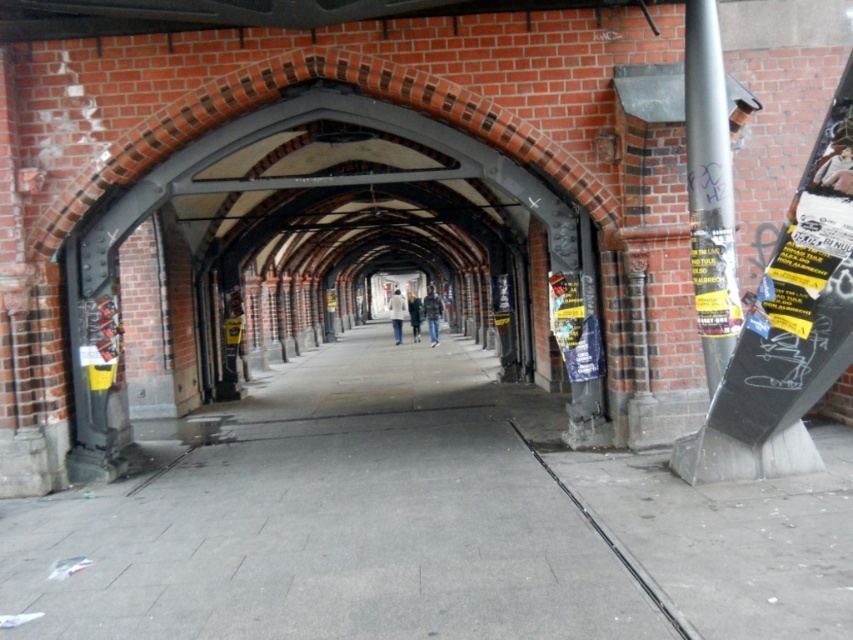
Which is above, gray concrete pavement at center or light beige coat at center?

Positioned higher is light beige coat at center.

From the picture: Who is more forward, (x=456, y=548) or (x=399, y=298)?

Point (x=456, y=548)

I want to click on gray concrete pavement at center, so click(329, 522).

Between dark blue jeans at center and white fabric coat at center, which one is positioned lower?

dark blue jeans at center is below.

Does point (438, 307) lie behind point (413, 330)?

Yes, point (438, 307) is farther from viewer.

Is point (428, 294) less distant than point (418, 307)?

No.

Locate an element on the screen. The image size is (853, 640). dark blue jeans at center is located at coordinates (432, 314).

Is gray concrete pavement at center to the left of silver metallic pole at right from the viewer's perspective?

Indeed, gray concrete pavement at center is positioned on the left side of silver metallic pole at right.

Is point (381, 576) less distant than point (711, 323)?

Yes, point (381, 576) is in front of point (711, 323).

Locate an element on the screen. gray concrete pavement at center is located at coordinates (329, 522).